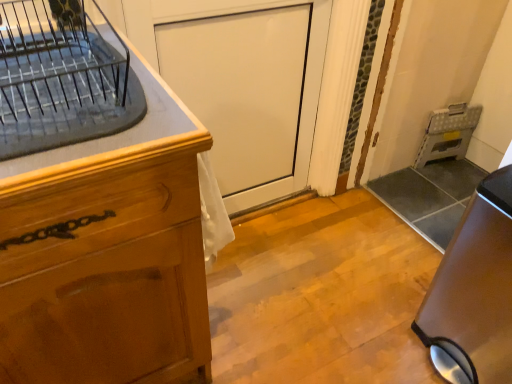
Question: From the image's perspective, does clear glass dish rack at upper left appear lower than satin brown trash can at lower right?

Choices:
 (A) no
 (B) yes

Answer: (A)

Question: Would you say satin brown trash can at lower right is part of clear glass dish rack at upper left's contents?

Choices:
 (A) no
 (B) yes

Answer: (A)

Question: Does clear glass dish rack at upper left have a greater height compared to satin brown trash can at lower right?

Choices:
 (A) no
 (B) yes

Answer: (A)

Question: Can you confirm if clear glass dish rack at upper left is bigger than satin brown trash can at lower right?

Choices:
 (A) no
 (B) yes

Answer: (A)

Question: Considering the relative sizes of clear glass dish rack at upper left and satin brown trash can at lower right in the image provided, is clear glass dish rack at upper left wider than satin brown trash can at lower right?

Choices:
 (A) yes
 (B) no

Answer: (A)

Question: Based on their sizes in the image, would you say white glossy door at center is bigger or smaller than metallic gray folding step stool at right?

Choices:
 (A) big
 (B) small

Answer: (A)

Question: Looking at their shapes, would you say white glossy door at center is wider or thinner than metallic gray folding step stool at right?

Choices:
 (A) wide
 (B) thin

Answer: (A)

Question: Is white glossy door at center situated inside metallic gray folding step stool at right or outside?

Choices:
 (A) outside
 (B) inside

Answer: (A)

Question: From a real-world perspective, is white glossy door at center above or below metallic gray folding step stool at right?

Choices:
 (A) above
 (B) below

Answer: (A)

Question: From the image's perspective, is satin brown trash can at lower right positioned above or below metallic gray folding step stool at right?

Choices:
 (A) below
 (B) above

Answer: (A)

Question: Do you think satin brown trash can at lower right is within metallic gray folding step stool at right, or outside of it?

Choices:
 (A) inside
 (B) outside

Answer: (B)

Question: Considering the positions of satin brown trash can at lower right and metallic gray folding step stool at right in the image, is satin brown trash can at lower right bigger or smaller than metallic gray folding step stool at right?

Choices:
 (A) big
 (B) small

Answer: (A)

Question: Considering the relative positions of satin brown trash can at lower right and metallic gray folding step stool at right in the image provided, is satin brown trash can at lower right to the left or to the right of metallic gray folding step stool at right?

Choices:
 (A) right
 (B) left

Answer: (B)

Question: Is clear glass dish rack at upper left to the left or to the right of white glossy door at center in the image?

Choices:
 (A) right
 (B) left

Answer: (B)

Question: Is point (165, 130) closer or farther from the camera than point (266, 107)?

Choices:
 (A) closer
 (B) farther

Answer: (A)